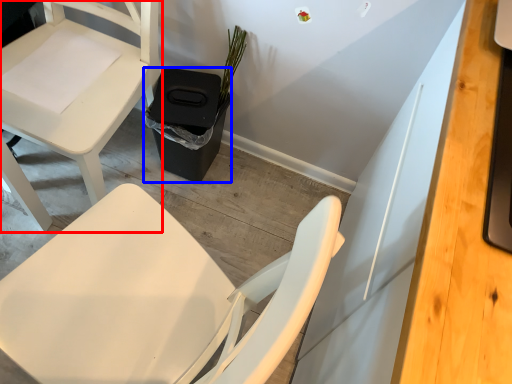
Question: Which object is further to the camera taking this photo, chair (highlighted by a red box) or trash bin/can (highlighted by a blue box)?

Choices:
 (A) chair
 (B) trash bin/can

Answer: (B)